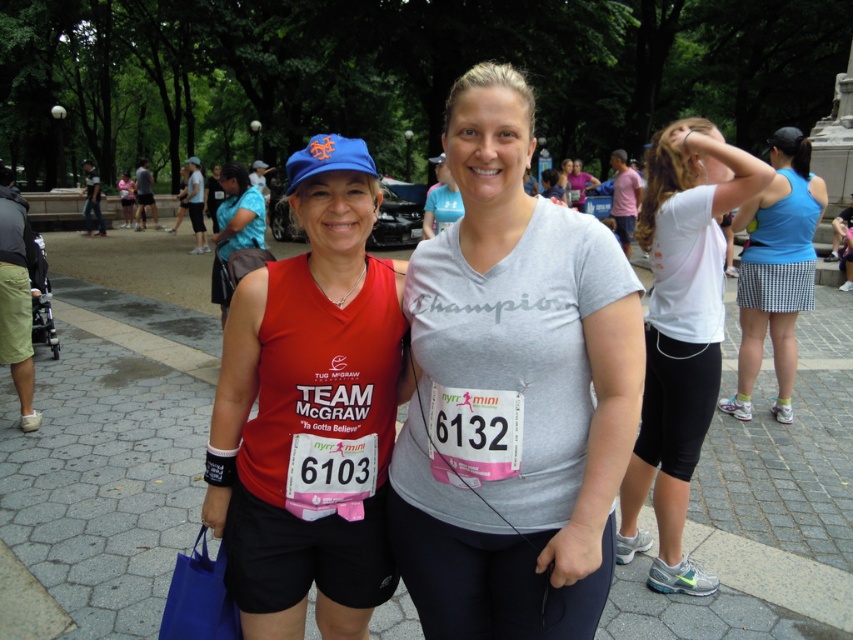
You are a photographer at the event and want to capture both the matte red tank top at center and the white matte shirt at upper right in a single frame. Given their sizes, which one should you zoom in on to ensure both fit clearly?

The matte red tank top at center is wider than the white matte shirt at upper right. To capture both clearly, you should zoom out slightly to accommodate the wider matte red tank top at center.

You are a photographer at the event and want to capture both the matte red tank top at center and the blue houndstooth skirt at right in a single shot. Considering their sizes, which object should you focus on to ensure both are clearly visible?

The matte red tank top at center is larger in size than the blue houndstooth skirt at right, so focusing on the matte red tank top at center will ensure both are clearly visible in the photo.